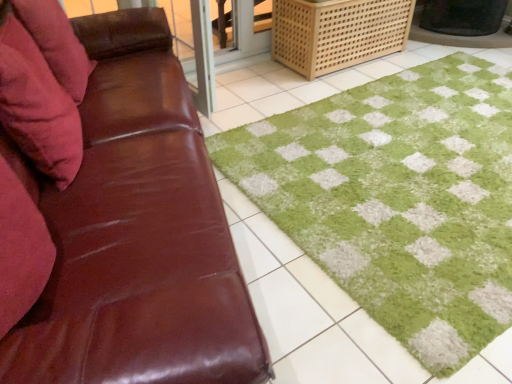
What is the approximate height of green shaggy bath mat at center?

green shaggy bath mat at center is 2.16 inches in height.

Locate an element on the screen. velvety pink pillow at left, which is counted as the 1th pillow, starting from the back is located at coordinates (56, 43).

Is green shaggy bath mat at center oriented towards brown leather couch at left?

No, green shaggy bath mat at center is not oriented towards brown leather couch at left.

From the image's perspective, is green shaggy bath mat at center located beneath brown leather couch at left?

No, from the image's perspective, green shaggy bath mat at center is not beneath brown leather couch at left.

Between green shaggy bath mat at center and brown leather couch at left, which one has more height?

brown leather couch at left.

In the scene shown: What's the angular difference between green shaggy bath mat at center and brown leather couch at left's facing directions?

green shaggy bath mat at center and brown leather couch at left are facing 108 degrees away from each other.

Consider the image. Considering the relative positions of velvet red pillow at left, which is counted as the second pillow, starting from the back, and brown leather couch at left in the image provided, is velvet red pillow at left, which is counted as the second pillow, starting from the back, behind brown leather couch at left?

Yes, the depth of velvet red pillow at left, which is counted as the second pillow, starting from the back, is greater than that of brown leather couch at left.

From the image's perspective, would you say velvet red pillow at left, arranged as the first pillow when viewed from the front, is shown under brown leather couch at left?

Incorrect, from the image's perspective, velvet red pillow at left, arranged as the first pillow when viewed from the front, is higher than brown leather couch at left.

Looking at this image, from a real-world perspective, which object stands above the other?

In real-world perspective, velvet red pillow at left, which is counted as the second pillow, starting from the back, is above.

Looking at this image, in the image, is velvet red pillow at left, which is counted as the second pillow, starting from the back, on the left side or the right side of brown leather couch at left?

velvet red pillow at left, which is counted as the second pillow, starting from the back, is to the left of brown leather couch at left.

From the image's perspective, is velvet red pillow at left, which is counted as the second pillow, starting from the back, positioned above or below light brown woven crate at upper right?

Based on their image positions, velvet red pillow at left, which is counted as the second pillow, starting from the back, is located beneath light brown woven crate at upper right.

From a real-world perspective, which object stands above the other?

velvet red pillow at left, which is counted as the second pillow, starting from the back, from a real-world perspective.

This screenshot has height=384, width=512. In order to click on crate located behind the velvet red pillow at left, arranged as the first pillow when viewed from the front in this screenshot , I will do `click(337, 33)`.

Could you tell me if velvet red pillow at left, which is counted as the second pillow, starting from the back, is turned towards light brown woven crate at upper right?

No.

Is velvety pink pillow at left, which is counted as the 1th pillow, starting from the back, located within brown leather couch at left?

Yes.

Does brown leather couch at left have a lesser height compared to velvety pink pillow at left, which ranks as the second pillow in front-to-back order?

No.

Between brown leather couch at left and velvety pink pillow at left, which is counted as the 1th pillow, starting from the back, which one has smaller size?

Smaller between the two is velvety pink pillow at left, which is counted as the 1th pillow, starting from the back.

Looking at their sizes, would you say brown leather couch at left is wider or thinner than velvety pink pillow at left, which is counted as the 1th pillow, starting from the back?

In the image, brown leather couch at left appears to be wider than velvety pink pillow at left, which is counted as the 1th pillow, starting from the back.

Is velvety pink pillow at left, which is counted as the 1th pillow, starting from the back, positioned with its back to velvet red pillow at left, which is counted as the second pillow, starting from the back?

No, velvety pink pillow at left, which is counted as the 1th pillow, starting from the back, is not facing the opposite direction of velvet red pillow at left, which is counted as the second pillow, starting from the back.

From the image's perspective, who appears lower, velvety pink pillow at left, which is counted as the 1th pillow, starting from the back, or velvet red pillow at left, which is counted as the second pillow, starting from the back?

From the image's view, velvet red pillow at left, which is counted as the second pillow, starting from the back, is below.

From a real-world perspective, relative to velvet red pillow at left, arranged as the first pillow when viewed from the front, is velvety pink pillow at left, which ranks as the second pillow in front-to-back order, vertically above or below?

Clearly, from a real-world perspective, velvety pink pillow at left, which ranks as the second pillow in front-to-back order, is below velvet red pillow at left, arranged as the first pillow when viewed from the front.

Does velvety pink pillow at left, which is counted as the 1th pillow, starting from the back, appear on the right side of velvet red pillow at left, arranged as the first pillow when viewed from the front?

No.

Is velvet red pillow at left, which is counted as the second pillow, starting from the back, facing towards velvety pink pillow at left, which is counted as the 1th pillow, starting from the back?

No, velvet red pillow at left, which is counted as the second pillow, starting from the back, is not turned towards velvety pink pillow at left, which is counted as the 1th pillow, starting from the back.

Is velvet red pillow at left, which is counted as the second pillow, starting from the back, not within velvety pink pillow at left, which ranks as the second pillow in front-to-back order?

Yes, velvet red pillow at left, which is counted as the second pillow, starting from the back, is not within velvety pink pillow at left, which ranks as the second pillow in front-to-back order.

Can you confirm if velvet red pillow at left, which is counted as the second pillow, starting from the back, is taller than velvety pink pillow at left, which is counted as the 1th pillow, starting from the back?

Indeed, velvet red pillow at left, which is counted as the second pillow, starting from the back, has a greater height compared to velvety pink pillow at left, which is counted as the 1th pillow, starting from the back.

Can you tell me how much velvet red pillow at left, which is counted as the second pillow, starting from the back, and velvety pink pillow at left, which ranks as the second pillow in front-to-back order, differ in facing direction?

1.98 degrees.

Based on the photo, could you tell me if light brown woven crate at upper right is facing velvety pink pillow at left, which ranks as the second pillow in front-to-back order?

No, light brown woven crate at upper right is not aimed at velvety pink pillow at left, which ranks as the second pillow in front-to-back order.

Is point (374, 52) positioned after point (85, 77)?

That is True.

Which of these two, light brown woven crate at upper right or velvety pink pillow at left, which is counted as the 1th pillow, starting from the back, stands shorter?

With less height is velvety pink pillow at left, which is counted as the 1th pillow, starting from the back.

Identify the location of crate located on the right of velvety pink pillow at left, which is counted as the 1th pillow, starting from the back. The height and width of the screenshot is (384, 512). (337, 33).

You are a GUI agent. You are given a task and a screenshot of the screen. Output one action in this format:
    pyautogui.click(x=<x>, y=<y>)
    Task: Click on the studio couch to the left of green shaggy bath mat at center
    Image resolution: width=512 pixels, height=384 pixels.
    Given the screenshot: What is the action you would take?
    pyautogui.click(x=136, y=234)

Where is `studio couch in front of the velvet red pillow at left, arranged as the first pillow when viewed from the front`? The image size is (512, 384). studio couch in front of the velvet red pillow at left, arranged as the first pillow when viewed from the front is located at coordinates (136, 234).

Considering their positions, is light brown woven crate at upper right positioned closer to brown leather couch at left than green shaggy bath mat at center?

The object closer to brown leather couch at left is green shaggy bath mat at center.

Considering their positions, is light brown woven crate at upper right positioned further to brown leather couch at left than velvet red pillow at left, arranged as the first pillow when viewed from the front?

light brown woven crate at upper right is further to brown leather couch at left.

Based on their spatial positions, is velvet red pillow at left, arranged as the first pillow when viewed from the front, or light brown woven crate at upper right further from velvety pink pillow at left, which is counted as the 1th pillow, starting from the back?

light brown woven crate at upper right lies further to velvety pink pillow at left, which is counted as the 1th pillow, starting from the back, than the other object.

Which object lies nearer to the anchor point green shaggy bath mat at center, velvety pink pillow at left, which is counted as the 1th pillow, starting from the back, or light brown woven crate at upper right?

The object closer to green shaggy bath mat at center is light brown woven crate at upper right.

Which object lies further to the anchor point velvet red pillow at left, which is counted as the second pillow, starting from the back, green shaggy bath mat at center or light brown woven crate at upper right?

The object further to velvet red pillow at left, which is counted as the second pillow, starting from the back, is light brown woven crate at upper right.

Estimate the real-world distances between objects in this image. Which object is closer to velvety pink pillow at left, which ranks as the second pillow in front-to-back order, brown leather couch at left or velvet red pillow at left, arranged as the first pillow when viewed from the front?

velvet red pillow at left, arranged as the first pillow when viewed from the front, is positioned closer to the anchor velvety pink pillow at left, which ranks as the second pillow in front-to-back order.

Based on their spatial positions, is brown leather couch at left or velvety pink pillow at left, which ranks as the second pillow in front-to-back order, further from velvet red pillow at left, which is counted as the second pillow, starting from the back?

brown leather couch at left lies further to velvet red pillow at left, which is counted as the second pillow, starting from the back, than the other object.

Estimate the real-world distances between objects in this image. Which object is closer to brown leather couch at left, velvety pink pillow at left, which ranks as the second pillow in front-to-back order, or green shaggy bath mat at center?

Among the two, velvety pink pillow at left, which ranks as the second pillow in front-to-back order, is located nearer to brown leather couch at left.

Where is `bath mat between brown leather couch at left and light brown woven crate at upper right in the front-back direction`? This screenshot has height=384, width=512. bath mat between brown leather couch at left and light brown woven crate at upper right in the front-back direction is located at coordinates (378, 217).

Where is `pillow between velvet red pillow at left, which is counted as the second pillow, starting from the back, and light brown woven crate at upper right in the front-back direction`? The width and height of the screenshot is (512, 384). pillow between velvet red pillow at left, which is counted as the second pillow, starting from the back, and light brown woven crate at upper right in the front-back direction is located at coordinates point(56,43).

The width and height of the screenshot is (512, 384). In order to click on crate located between velvet red pillow at left, which is counted as the second pillow, starting from the back, and green shaggy bath mat at center in the left-right direction in this screenshot , I will do `click(337, 33)`.

The width and height of the screenshot is (512, 384). Find the location of `pillow between velvety pink pillow at left, which is counted as the 1th pillow, starting from the back, and green shaggy bath mat at center from left to right`. pillow between velvety pink pillow at left, which is counted as the 1th pillow, starting from the back, and green shaggy bath mat at center from left to right is located at coordinates (42, 86).